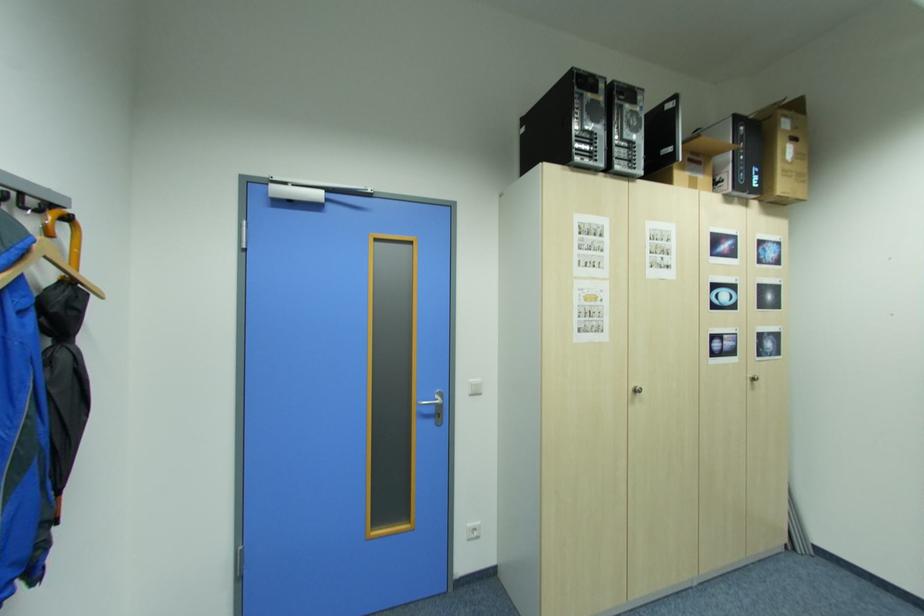
Find where to pull the silver door handle. Please return your answer as a coordinate pair (x, y).

(435, 406)